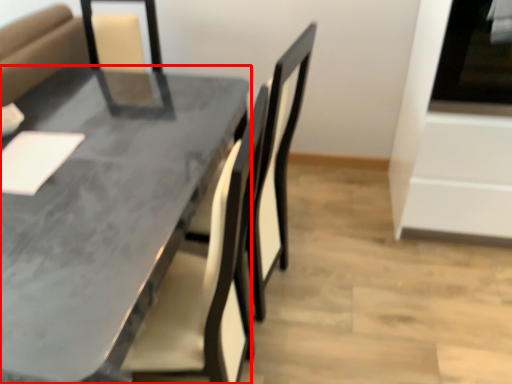
Question: From the image, what is the correct spatial relationship of table (annotated by the red box) in relation to oven?

Choices:
 (A) left
 (B) right

Answer: (A)